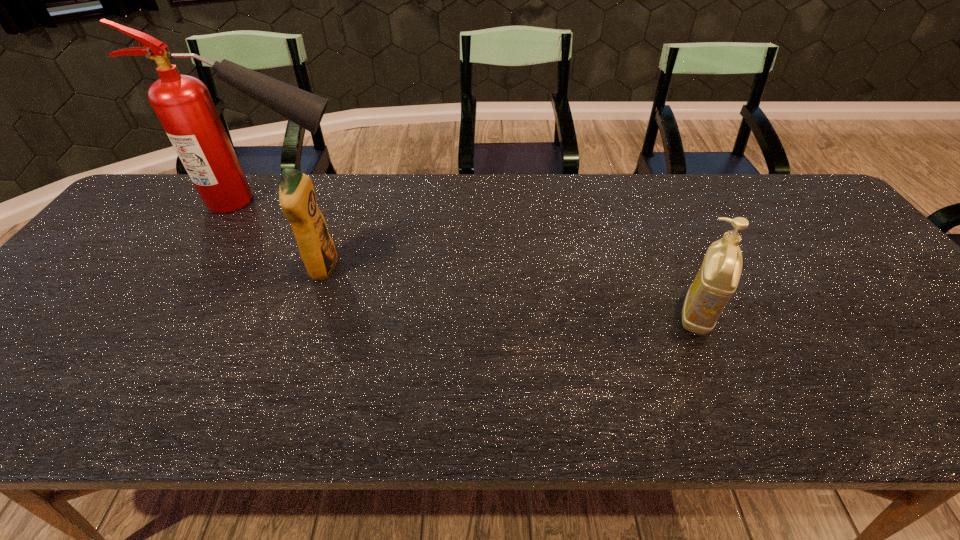
Locate an element on the screen. free point at the far edge is located at coordinates (338, 176).

In the image, there is a desktop. At what (x,y) coordinates should I click in order to perform the action: click on vacant space at the near edge. Please return your answer as a coordinate pair (x, y). Looking at the image, I should click on (660, 395).

The width and height of the screenshot is (960, 540). What are the coordinates of `vacant space at the right edge of the desktop` in the screenshot? It's located at (914, 349).

Locate an element on the screen. Image resolution: width=960 pixels, height=540 pixels. vacant space at the far right corner of the desktop is located at coordinates (771, 190).

Find the location of `vacant point located between the second shortest object and the shorter detergent`. vacant point located between the second shortest object and the shorter detergent is located at coordinates [x=510, y=292].

Locate an element on the screen. vacant space in between the shortest object and the taller detergent is located at coordinates (510, 292).

Identify the location of unoccupied area between the second farthest object and the right detergent. (510, 292).

Where is `empty space between the shortest object and the farthest object`? This screenshot has width=960, height=540. empty space between the shortest object and the farthest object is located at coordinates (484, 258).

Image resolution: width=960 pixels, height=540 pixels. Find the location of `free area in between the shortest object and the tallest object`. free area in between the shortest object and the tallest object is located at coordinates (484, 258).

The image size is (960, 540). I want to click on free spot between the fire extinguisher and the shortest object, so click(484, 258).